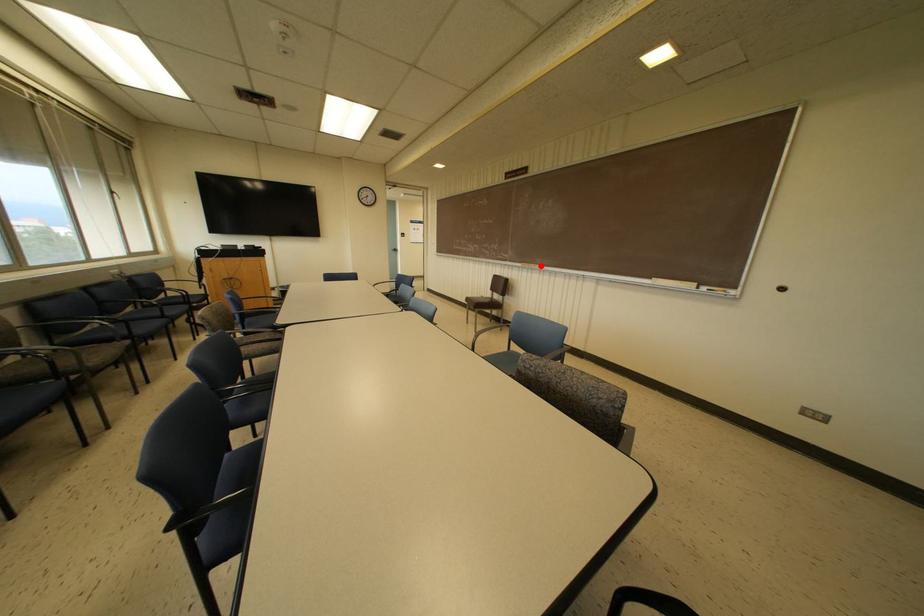
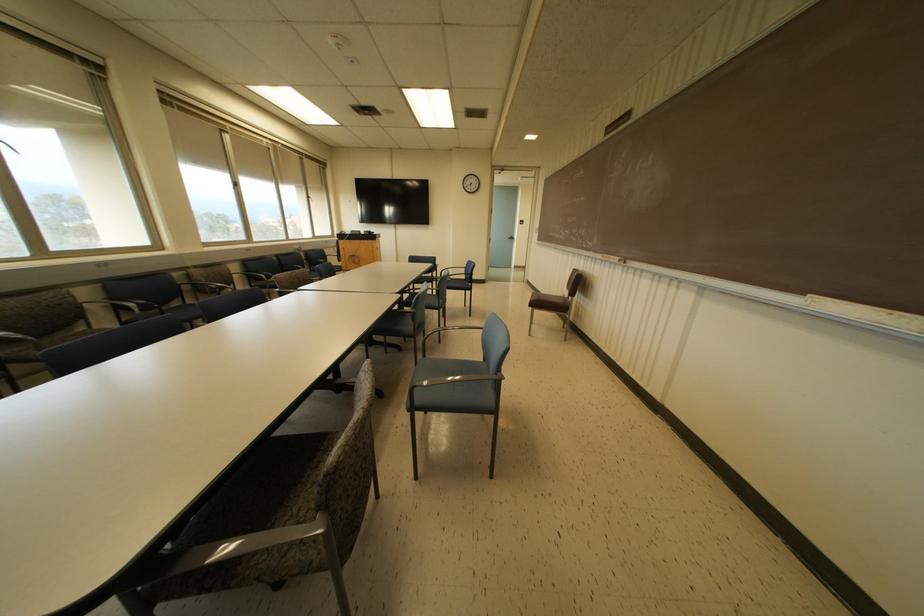
Find the pixel in the second image that matches the highlighted location in the first image.

(623, 259)